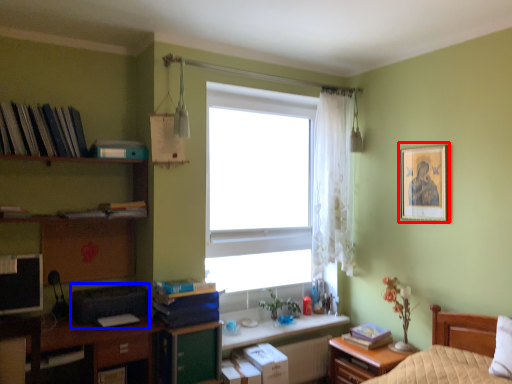
Question: Which of the following is the farthest to the observer, picture frame (highlighted by a red box) or printer (highlighted by a blue box)?

Choices:
 (A) picture frame
 (B) printer

Answer: (A)